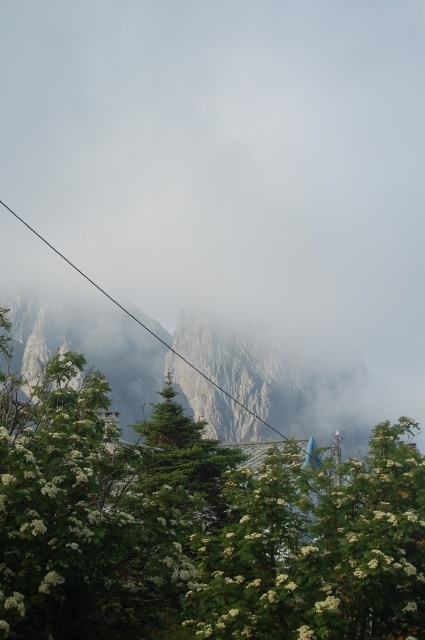
Question: Does foggy misty mountain at upper center appear on the right side of black wire at upper center?

Choices:
 (A) no
 (B) yes

Answer: (B)

Question: Based on their relative distances, which object is nearer to the foggy misty mountain at upper center?

Choices:
 (A) green matte tree at center
 (B) black wire at upper center

Answer: (B)

Question: Is green leafy tree at center below green matte tree at center?

Choices:
 (A) yes
 (B) no

Answer: (B)

Question: Among these objects, which one is nearest to the camera?

Choices:
 (A) green matte tree at center
 (B) black wire at upper center
 (C) foggy misty mountain at upper center

Answer: (C)

Question: Which point appears farthest from the camera in this image?

Choices:
 (A) (317, 472)
 (B) (73, 157)
 (C) (286, 435)
 (D) (197, 422)

Answer: (B)

Question: Can you confirm if green matte tree at center is thinner than black wire at upper center?

Choices:
 (A) yes
 (B) no

Answer: (A)